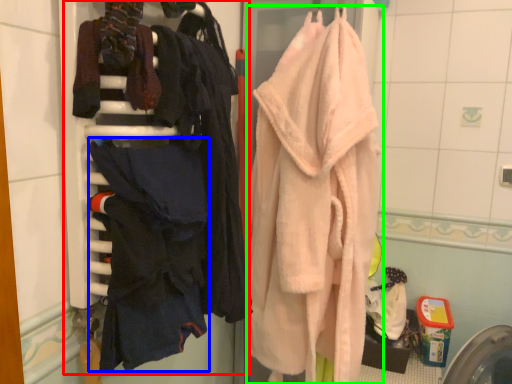
Question: Based on their relative distances, which object is nearer to closet (highlighted by a red box)? Choose from clothing (highlighted by a blue box) and towel (highlighted by a green box).

Choices:
 (A) clothing
 (B) towel

Answer: (A)